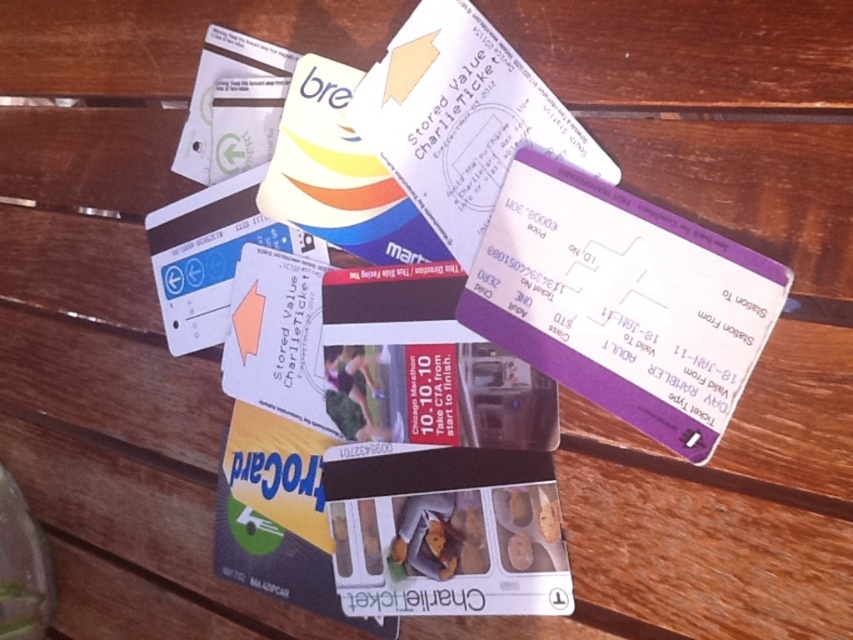
Does point (685, 256) come farther from viewer compared to point (367, 90)?

That is False.

Where is `purple card at upper right`? This screenshot has height=640, width=853. purple card at upper right is located at coordinates (622, 301).

Identify the location of purple card at upper right. (622, 301).